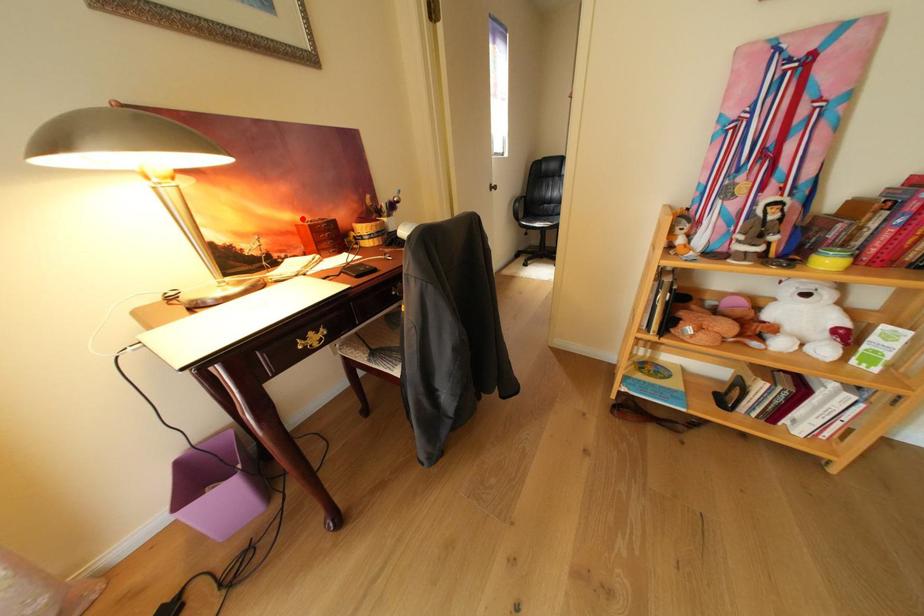
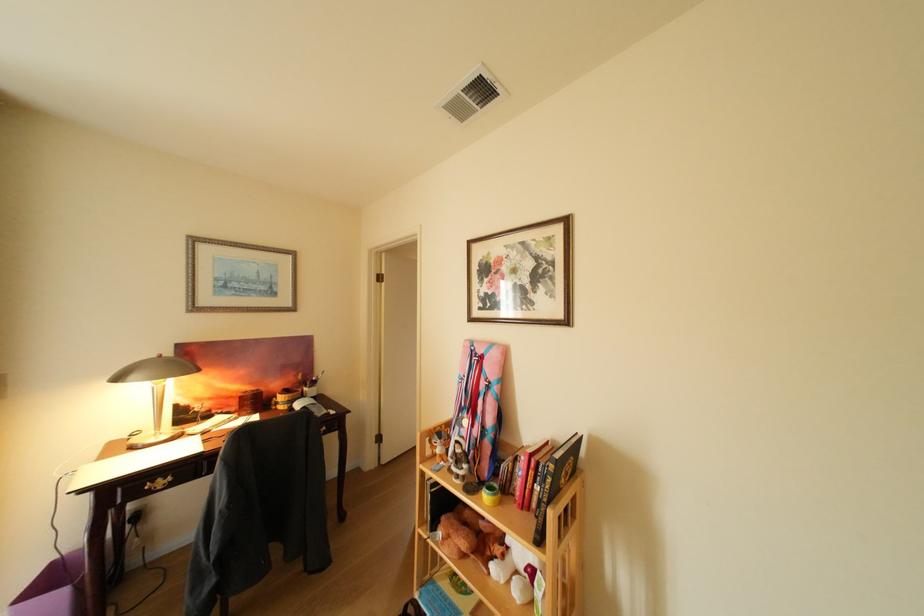
The point at the highlighted location is marked in the first image. Where is the corresponding point in the second image?

(251, 389)